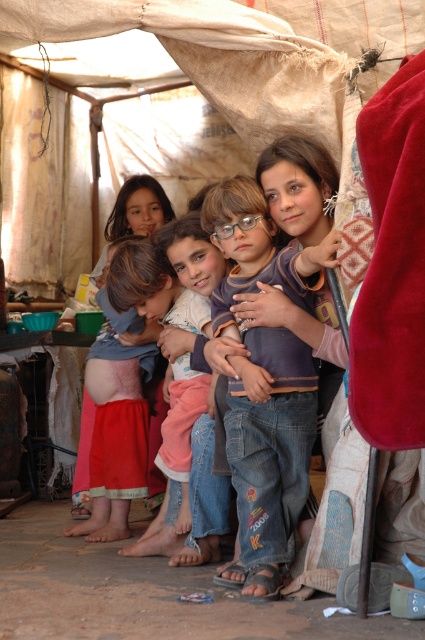
Does denim jeans at center appear on the left side of red cotton dress at lower left?

Incorrect, denim jeans at center is not on the left side of red cotton dress at lower left.

Between point (288, 380) and point (121, 416), which one is positioned in front?

Positioned in front is point (288, 380).

The height and width of the screenshot is (640, 425). Identify the location of denim jeans at center. (265, 378).

Does point (252, 214) come closer to viewer compared to point (215, 497)?

Yes, it is.

Does denim jeans at center have a greater height compared to jeans at center?

Indeed, denim jeans at center has a greater height compared to jeans at center.

Based on the photo, who is more distant from viewer, (285, 365) or (217, 260)?

Positioned behind is point (217, 260).

Where is `denim jeans at center`? Image resolution: width=425 pixels, height=640 pixels. denim jeans at center is located at coordinates (265, 378).

Who is positioned more to the right, red cotton dress at lower left or jeans at center?

jeans at center

Who is taller, red cotton dress at lower left or jeans at center?

Standing taller between the two is red cotton dress at lower left.

Measure the distance between point [118,536] and camera.

Point [118,536] and camera are 4.34 meters apart.

Where is `red cotton dress at lower left`? The width and height of the screenshot is (425, 640). red cotton dress at lower left is located at coordinates (116, 428).